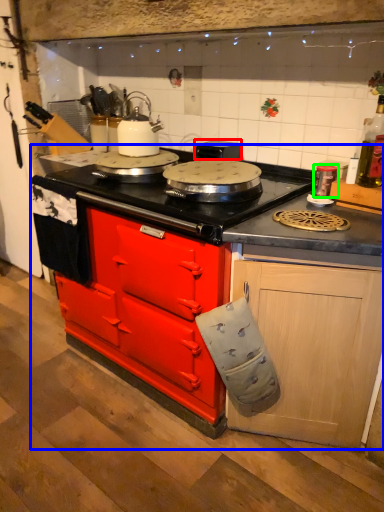
Question: Which object is the closest to the appliance (highlighted by a red box)? Choose among these: countertop (highlighted by a blue box) or kitchen appliance (highlighted by a green box).

Choices:
 (A) countertop
 (B) kitchen appliance

Answer: (B)